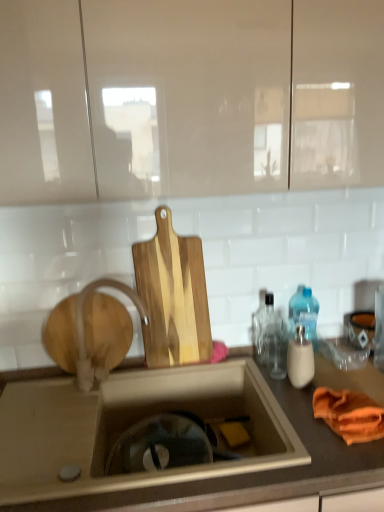
The height and width of the screenshot is (512, 384). I want to click on free space above matte gray countertop at center (from a real-world perspective), so click(x=208, y=361).